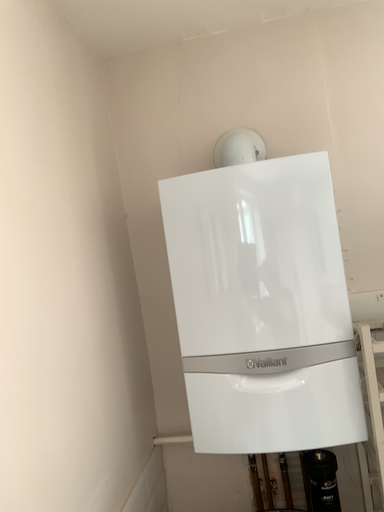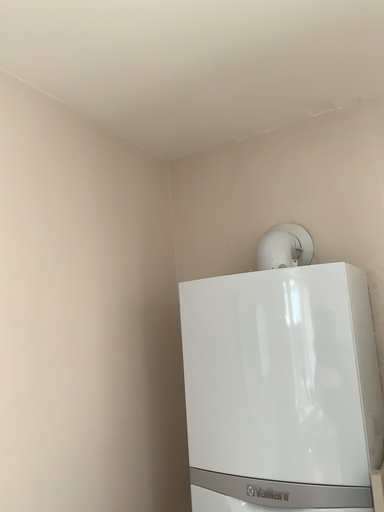
Question: How did the camera likely rotate when shooting the video?

Choices:
 (A) rotated right
 (B) rotated left

Answer: (B)